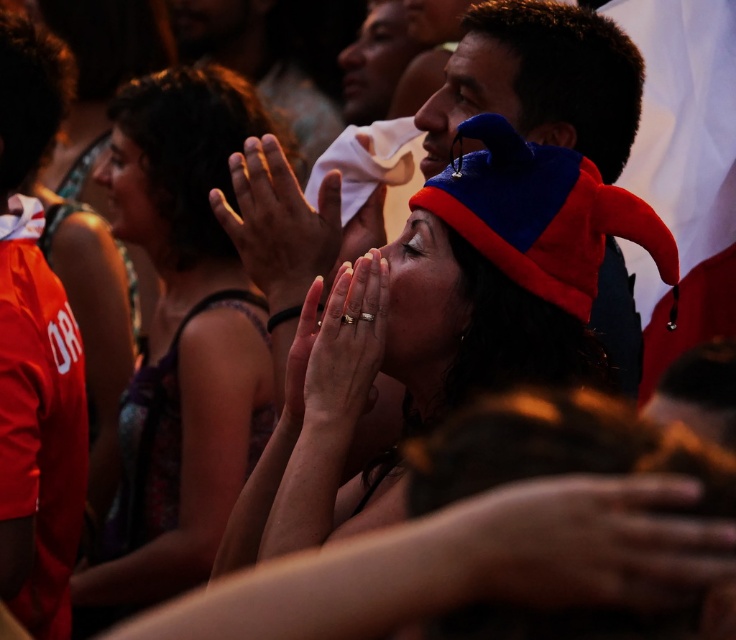
Between gold metallic ring at center and smooth skin face at upper left, which one has less height?

With less height is gold metallic ring at center.

Which is above, gold metallic ring at center or smooth skin face at upper left?

Positioned higher is smooth skin face at upper left.

Locate an element on the screen. gold metallic ring at center is located at coordinates (347, 348).

Measure the distance between matte black dress at center and smooth skin face at upper left.

matte black dress at center and smooth skin face at upper left are 14.25 inches apart.

Does point (205, 314) come in front of point (102, 168)?

Yes, point (205, 314) is closer to viewer.

Measure the distance between matte black dress at center and camera.

matte black dress at center and camera are 10.18 feet apart from each other.

At what (x,y) coordinates should I click in order to perform the action: click on matte black dress at center. Please return your answer as a coordinate pair (x, y). Looking at the image, I should click on (180, 342).

Can you confirm if smooth skin face at center is positioned to the right of blue fleece hat at upper center?

No, smooth skin face at center is not to the right of blue fleece hat at upper center.

Where is `smooth skin face at center`? Image resolution: width=736 pixels, height=640 pixels. smooth skin face at center is located at coordinates (422, 298).

This screenshot has width=736, height=640. In order to click on smooth skin face at center in this screenshot , I will do `click(422, 298)`.

You are a GUI agent. You are given a task and a screenshot of the screen. Output one action in this format:
    pyautogui.click(x=<x>, y=<y>)
    Task: Click on the smooth skin face at center
    This screenshot has height=640, width=736.
    Given the screenshot: What is the action you would take?
    pyautogui.click(x=422, y=298)